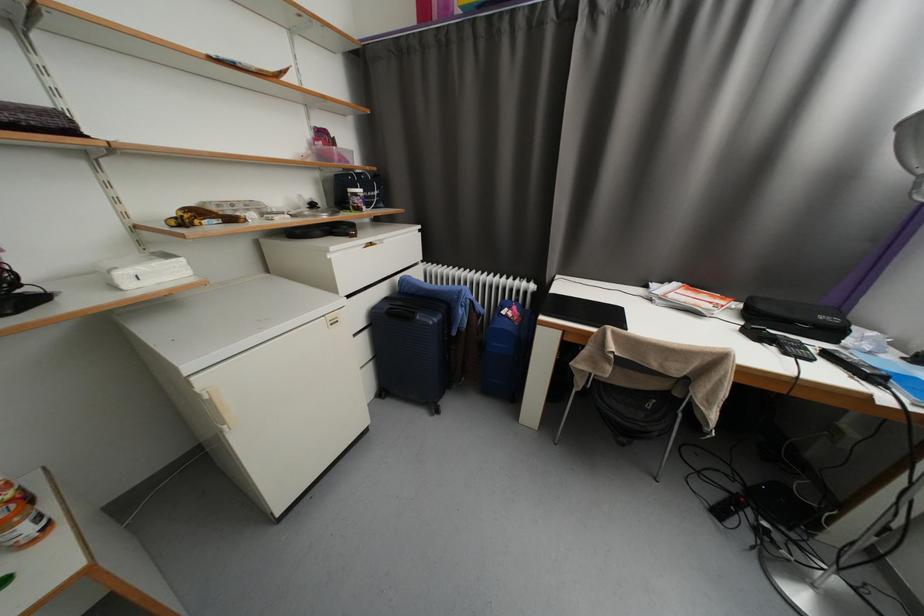
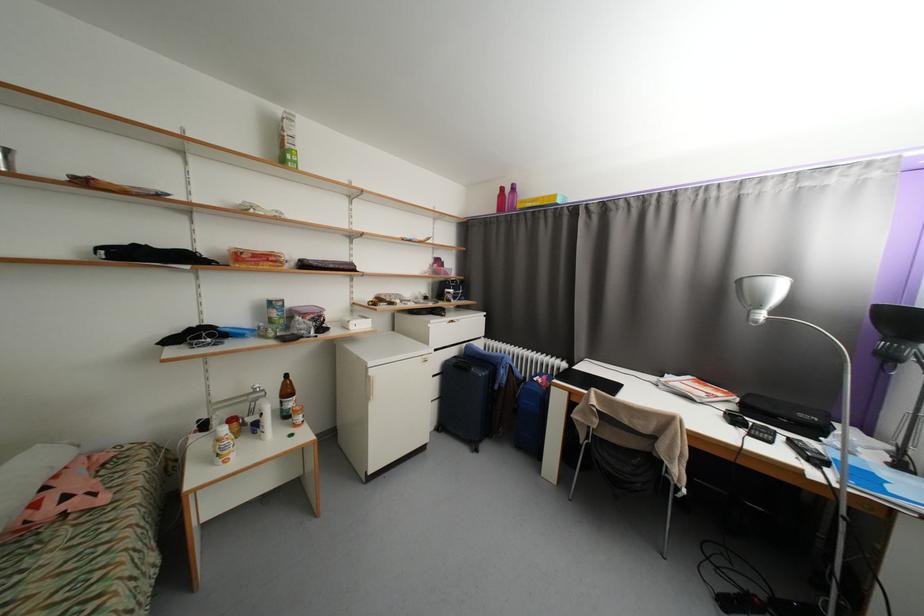
Question: I am providing you with two images of the same scene from different viewpoints. After the viewpoint changes to image2, which objects are now occluded?

Choices:
 (A) purple plastic bottle
 (B) pink plastic bottle
 (C) white drawer handle
 (D) none of these

Answer: (D)